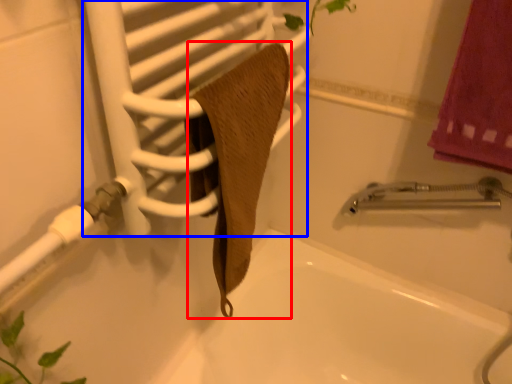
Question: Among these objects, which one is farthest to the camera, bath towel (highlighted by a red box) or screen door (highlighted by a blue box)?

Choices:
 (A) bath towel
 (B) screen door

Answer: (A)